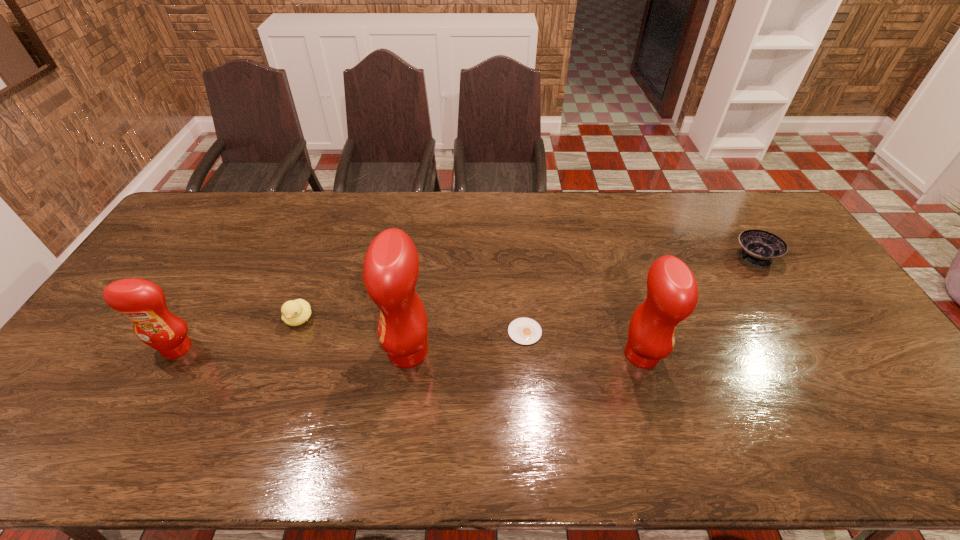
Where is `the third tallest object`? Image resolution: width=960 pixels, height=540 pixels. the third tallest object is located at coordinates coord(142,301).

The height and width of the screenshot is (540, 960). Identify the location of the leftmost condiment. (142, 301).

Where is `the second condiment from left to right`? the second condiment from left to right is located at coordinates (390, 271).

This screenshot has width=960, height=540. Find the location of `the fourth object from right to left`. the fourth object from right to left is located at coordinates (390, 271).

Where is `the fifth object from left to right`? The width and height of the screenshot is (960, 540). the fifth object from left to right is located at coordinates (672, 294).

This screenshot has width=960, height=540. I want to click on the second shortest condiment, so click(672, 294).

This screenshot has height=540, width=960. I want to click on the second shortest object, so click(759, 248).

Identify the location of the rightmost object. This screenshot has height=540, width=960. (759, 248).

The image size is (960, 540). In order to click on duckling in this screenshot , I will do `click(295, 312)`.

Find the location of a particular element. This screenshot has height=540, width=960. the shortest object is located at coordinates (526, 331).